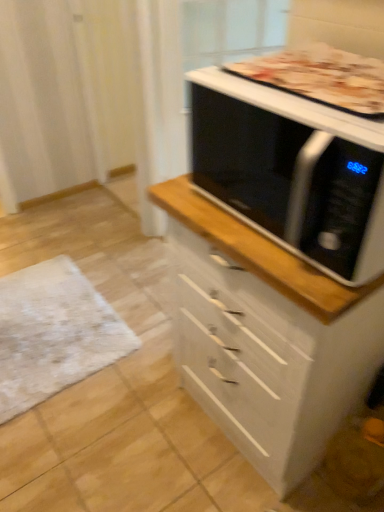
Locate an element on the screen. The height and width of the screenshot is (512, 384). free space above white textured mat at lower left (from a real-world perspective) is located at coordinates click(x=52, y=322).